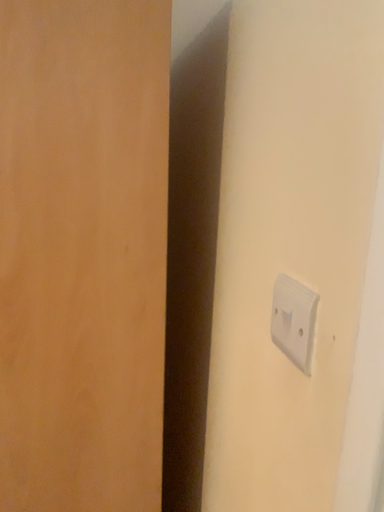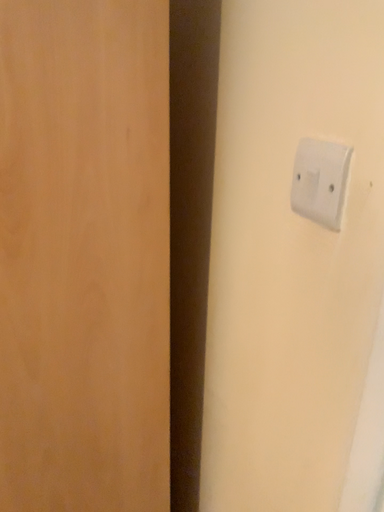
Question: How did the camera likely rotate when shooting the video?

Choices:
 (A) rotated upward
 (B) rotated downward

Answer: (B)